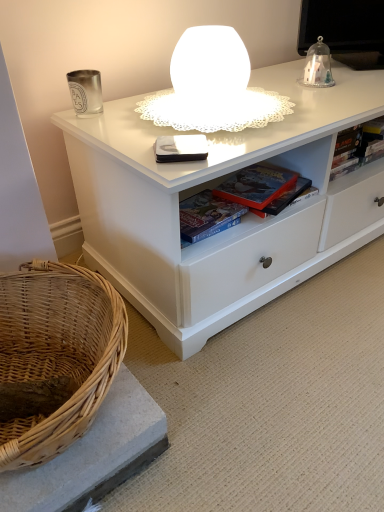
Question: Is point (210, 230) closer or farther from the camera than point (362, 125)?

Choices:
 (A) closer
 (B) farther

Answer: (A)

Question: Is matte board game at center, arranged as the 2th book when viewed from the front, to the left or to the right of hardcover book at upper right, which is the fourth book from left to right, in the image?

Choices:
 (A) right
 (B) left

Answer: (B)

Question: Estimate the real-world distances between objects in this image. Which object is farther from the glossy black book at center, the 4th book viewed from the right?

Choices:
 (A) matte plastic book at center, marked as the second book in a right-to-left arrangement
 (B) matte board game at center, acting as the 2th book starting from the left
 (C) white frosted glass table lamp at upper center
 (D) hardcover book at upper right, the first book positioned from the back

Answer: (D)

Question: Which object is the closest to the hardcover book at upper right, the first book positioned from the back?

Choices:
 (A) matte board game at center, acting as the 2th book starting from the left
 (B) matte plastic book at center, marked as the second book in a right-to-left arrangement
 (C) white frosted glass table lamp at upper center
 (D) glossy black book at center, which is the first book in front-to-back order

Answer: (B)